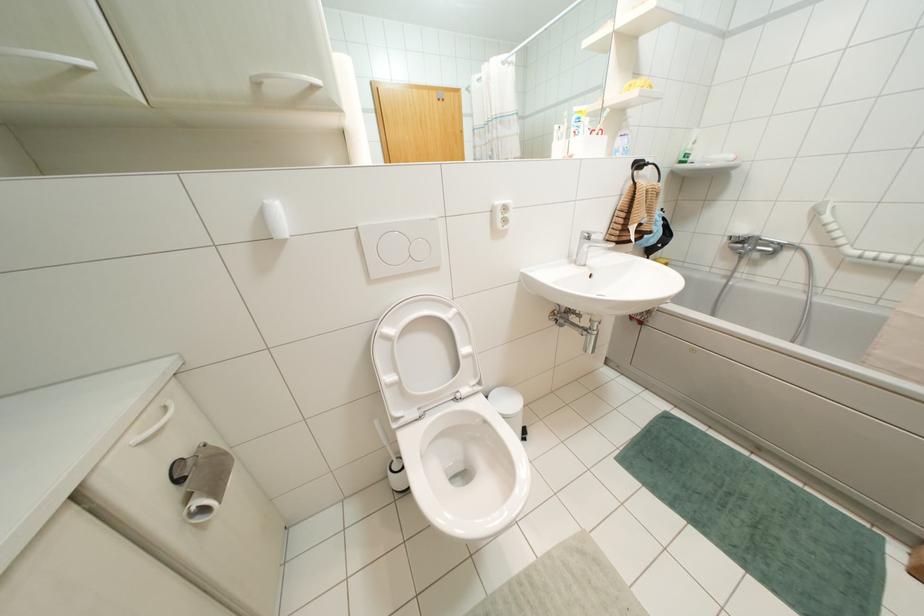
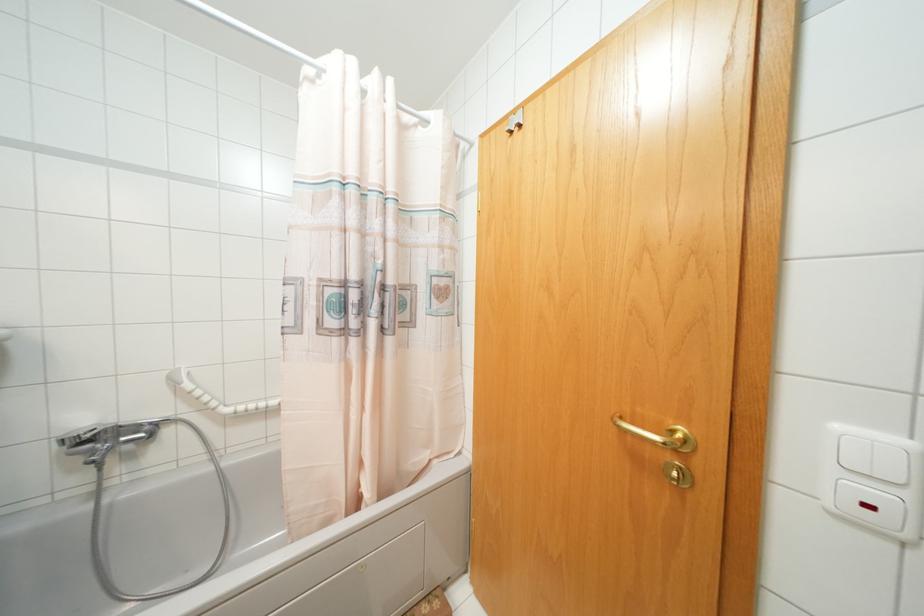
The point at (x=739, y=240) is marked in the first image. Where is the corresponding point in the second image?

(84, 440)